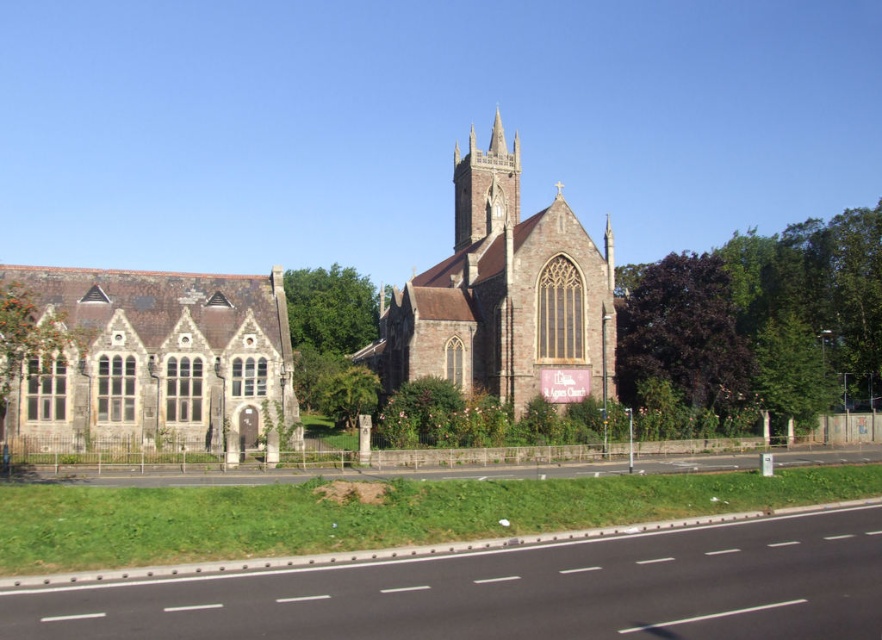
You are a GUI agent. You are given a task and a screenshot of the screen. Output one action in this format:
    pyautogui.click(x=<x>, y=<y>)
    Task: Click on the stone church at left
    Image resolution: width=882 pixels, height=640 pixels.
    Given the screenshot: What is the action you would take?
    pyautogui.click(x=155, y=362)

Does stone church at left come in front of smooth brick spire at center?

Yes.

The image size is (882, 640). Identify the location of stone church at left. (155, 362).

Does brown stone church at center appear over smooth brick spire at center?

No.

Between point (410, 301) and point (462, 170), which one is positioned behind?

The point (462, 170) is behind.

Which is behind, point (558, 301) or point (458, 172)?

Point (458, 172)

At what (x,y) coordinates should I click in order to perform the action: click on brown stone church at center. Please return your answer as a coordinate pair (x, y). This screenshot has width=882, height=640. Looking at the image, I should click on (505, 296).

Does stone church at left lie in front of brown stone church at center?

Yes, stone church at left is in front of brown stone church at center.

Is stone church at left above brown stone church at center?

No, stone church at left is not above brown stone church at center.

Where is `stone church at left`? stone church at left is located at coordinates [155, 362].